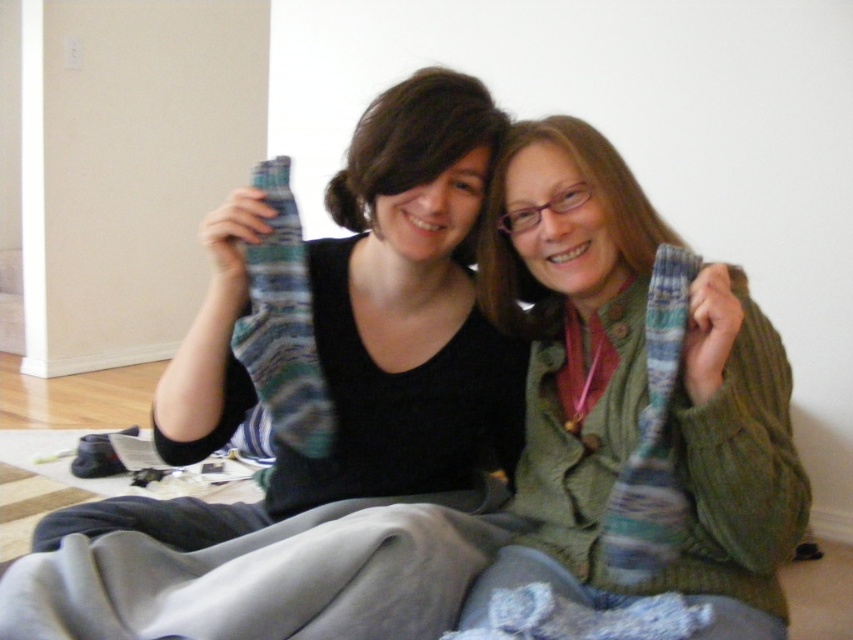
Question: Does striped wool sock at upper center appear over knitted wool scarf at right?

Choices:
 (A) yes
 (B) no

Answer: (A)

Question: Among these objects, which one is farthest from the camera?

Choices:
 (A) striped wool sock at upper center
 (B) striped wool socks at center
 (C) knitted green sweater at center
 (D) knitted wool scarf at right

Answer: (A)

Question: Which object is closer to the camera taking this photo?

Choices:
 (A) knitted wool scarf at right
 (B) striped wool socks at center
 (C) striped wool sock at upper center

Answer: (A)

Question: Among these objects, which one is farthest from the camera?

Choices:
 (A) striped wool sock at upper center
 (B) striped wool socks at center
 (C) knitted green sweater at center
 (D) knitted wool scarf at right

Answer: (A)

Question: Is knitted green sweater at center to the right of striped wool socks at center from the viewer's perspective?

Choices:
 (A) no
 (B) yes

Answer: (B)

Question: Does knitted green sweater at center appear over knitted wool scarf at right?

Choices:
 (A) no
 (B) yes

Answer: (B)